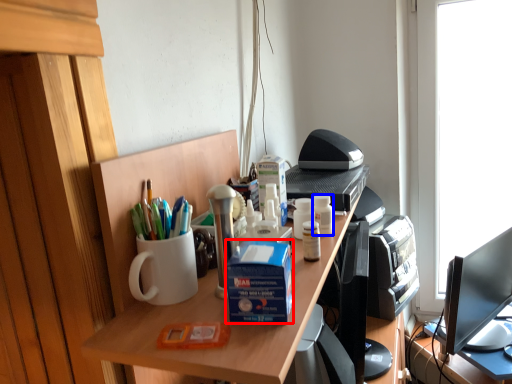
Question: Among these objects, which one is nearest to the camera, box (highlighted by a red box) or stationery (highlighted by a blue box)?

Choices:
 (A) box
 (B) stationery

Answer: (A)